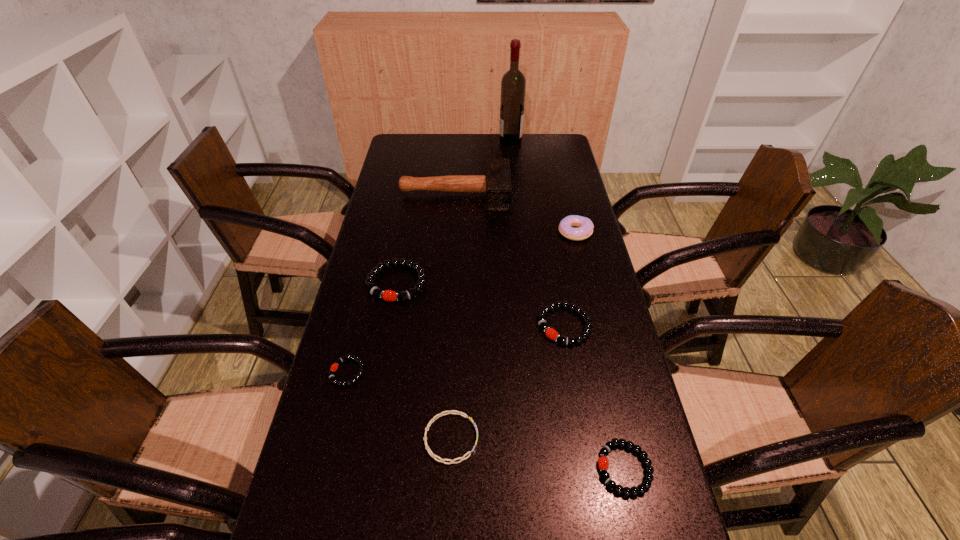
Where is `free space located on the back of the fourth nearest object`? free space located on the back of the fourth nearest object is located at coordinates (552, 253).

Image resolution: width=960 pixels, height=540 pixels. What are the coordinates of `vacant space located on the back of the nearest black bracelet` in the screenshot? It's located at (603, 374).

I want to click on blank space located 0.200m on the surface of the third bracelet from right to left showing star-shaped elements, so click(x=569, y=438).

Find the location of a particular element. Image resolution: width=960 pixels, height=540 pixels. vacant space located 0.170m on the back of the smallest black bracelet is located at coordinates (364, 306).

Where is `object located in the far edge section of the desktop`? The height and width of the screenshot is (540, 960). object located in the far edge section of the desktop is located at coordinates (513, 84).

Identify the location of mallet that is at the left edge. (496, 182).

You are a GUI agent. You are given a task and a screenshot of the screen. Output one action in this format:
    pyautogui.click(x=<x>, y=<y>)
    Task: Click on the doughnut present at the right edge
    The height and width of the screenshot is (540, 960).
    Given the screenshot: What is the action you would take?
    [585, 230]

In order to click on free space at the far edge in this screenshot , I will do `click(514, 159)`.

The height and width of the screenshot is (540, 960). In the image, there is a desktop. Find the location of `blank space at the left edge`. blank space at the left edge is located at coordinates (395, 284).

Where is `vacant space at the right edge of the desktop`? vacant space at the right edge of the desktop is located at coordinates (575, 207).